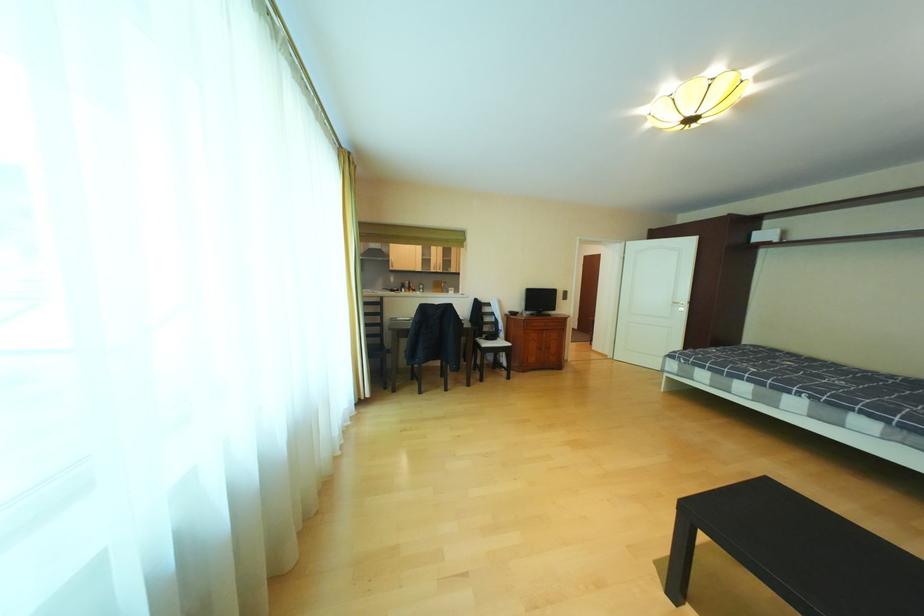
I want to click on white door handle, so click(678, 305).